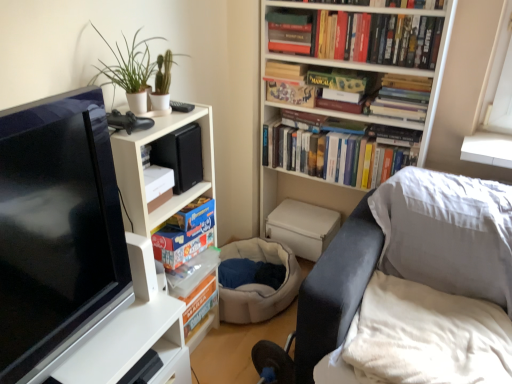
Describe the element at coordinates (289, 32) in the screenshot. I see `hardcover book at upper center, which appears as the 1th book when viewed from the top` at that location.

In order to click on dark gray leather swivel chair at lower right in this screenshot , I will do `click(327, 299)`.

What do you see at coordinates (370, 71) in the screenshot? The image size is (512, 384). I see `white matte bookcase at upper center, which is counted as the second bookcase, starting from the left` at bounding box center [370, 71].

The width and height of the screenshot is (512, 384). I want to click on hardcover book at upper center, which appears as the 1th book when viewed from the top, so click(x=289, y=32).

Considering the relative sizes of green matte plant at upper left and matte board game at center, the sixth book viewed from the top, in the image provided, is green matte plant at upper left wider than matte board game at center, the sixth book viewed from the top,?

No, green matte plant at upper left is not wider than matte board game at center, the sixth book viewed from the top.

Could you measure the distance between green matte plant at upper left and matte board game at center, the sixth book viewed from the top?

green matte plant at upper left is 18.17 inches away from matte board game at center, the sixth book viewed from the top.

From a real-world perspective, is green matte plant at upper left located higher than matte board game at center, the sixth book viewed from the top?

Yes, from a real-world perspective, green matte plant at upper left is over matte board game at center, the sixth book viewed from the top

This screenshot has height=384, width=512. I want to click on the 2nd book below the green matte plant at upper left (from the image's perspective), so click(185, 234).

Considering the relative sizes of white matte bookcase at upper center, arranged as the first bookcase when viewed from the right, and white glossy table at left in the image provided, is white matte bookcase at upper center, arranged as the first bookcase when viewed from the right, wider than white glossy table at left?

In fact, white matte bookcase at upper center, arranged as the first bookcase when viewed from the right, might be narrower than white glossy table at left.

How different are the orientations of white matte bookcase at upper center, arranged as the first bookcase when viewed from the right, and white glossy table at left in degrees?

89.7 degrees separate the facing orientations of white matte bookcase at upper center, arranged as the first bookcase when viewed from the right, and white glossy table at left.

Measure the distance between white matte bookcase at upper center, which is counted as the second bookcase, starting from the left, and white glossy table at left.

A distance of 4.16 feet exists between white matte bookcase at upper center, which is counted as the second bookcase, starting from the left, and white glossy table at left.

Which is more to the left, white matte bookcase at upper center, which is counted as the second bookcase, starting from the left, or white glossy table at left?

Positioned to the left is white glossy table at left.

Looking at this image, which of these two, matte black tv at left or hardcover book at upper center, which is counted as the 2th book, starting from the top, is wider?

matte black tv at left is wider.

Is point (35, 362) positioned behind point (418, 46)?

No, (35, 362) is closer to viewer.

From a real-world perspective, is matte black tv at left physically above hardcover book at upper center, acting as the 5th book starting from the bottom?

No, from a real-world perspective, matte black tv at left is not on top of hardcover book at upper center, acting as the 5th book starting from the bottom.

Can you confirm if matte black tv at left is shorter than hardcover book at upper center, which is counted as the 2th book, starting from the top?

No, matte black tv at left is not shorter than hardcover book at upper center, which is counted as the 2th book, starting from the top.

Considering the sizes of white matte bookcase at upper left, which is the first bookcase from left to right, and matte black tv at left in the image, is white matte bookcase at upper left, which is the first bookcase from left to right, bigger or smaller than matte black tv at left?

In the image, white matte bookcase at upper left, which is the first bookcase from left to right, appears to be larger than matte black tv at left.

Is the surface of white matte bookcase at upper left, which ranks as the second bookcase in right-to-left order, in direct contact with matte black tv at left?

white matte bookcase at upper left, which ranks as the second bookcase in right-to-left order, and matte black tv at left are not in contact.

Is point (142, 181) positioned before point (25, 369)?

No, it is not.

From a real-world perspective, is white matte bookcase at upper left, which ranks as the second bookcase in right-to-left order, positioned under matte black tv at left based on gravity?

Yes, from a real-world perspective, white matte bookcase at upper left, which ranks as the second bookcase in right-to-left order, is under matte black tv at left.

From a real-world perspective, between white soft blanket at lower right and white matte bookcase at upper center, which is counted as the second bookcase, starting from the left, who is vertically higher?

white matte bookcase at upper center, which is counted as the second bookcase, starting from the left, is physically above.

How different are the orientations of white soft blanket at lower right and white matte bookcase at upper center, arranged as the first bookcase when viewed from the right, in degrees?

They differ by 0.314 degrees in their facing directions.

Is white soft blanket at lower right touching white matte bookcase at upper center, arranged as the first bookcase when viewed from the right?

No, white soft blanket at lower right is not with white matte bookcase at upper center, arranged as the first bookcase when viewed from the right.

Consider the image. Is white matte bookcase at upper center, which is counted as the second bookcase, starting from the left, surrounded by white soft blanket at lower right?

Actually, white matte bookcase at upper center, which is counted as the second bookcase, starting from the left, is outside white soft blanket at lower right.

Based on the photo, can you confirm if dark gray leather swivel chair at lower right is wider than hardcover books at upper center, the third book in the bottom-to-top sequence?

Indeed, dark gray leather swivel chair at lower right has a greater width compared to hardcover books at upper center, the third book in the bottom-to-top sequence.

From a real-world perspective, is dark gray leather swivel chair at lower right beneath hardcover books at upper center, which is counted as the 4th book, starting from the top?

Yes, from a real-world perspective, dark gray leather swivel chair at lower right is under hardcover books at upper center, which is counted as the 4th book, starting from the top.

Is dark gray leather swivel chair at lower right positioned with its back to hardcover books at upper center, which is counted as the 4th book, starting from the top?

No, dark gray leather swivel chair at lower right is not facing away from hardcover books at upper center, which is counted as the 4th book, starting from the top.

Is point (291, 41) closer or farther from the camera than point (50, 335)?

Point (291, 41).

Can we say hardcover book at upper center, which is counted as the 2th book, starting from the top, lies outside matte black tv at left?

hardcover book at upper center, which is counted as the 2th book, starting from the top, lies outside matte black tv at left's area.

This screenshot has height=384, width=512. In order to click on television directly beneath the hardcover book at upper center, which is counted as the 2th book, starting from the top (from a real-world perspective) in this screenshot , I will do `click(57, 231)`.

Considering the relative sizes of hardcover book at upper center, which is counted as the 2th book, starting from the top, and matte black tv at left in the image provided, is hardcover book at upper center, which is counted as the 2th book, starting from the top, smaller than matte black tv at left?

Yes.

From the image's perspective, count 2nd books downward from the green matte plant at upper left and point to it. Please provide its 2D coordinates.

[(185, 234)]

From the image's perspective, which bookcase is the 2nd one above the white glossy table at left? Please provide its 2D coordinates.

[(370, 71)]

Based on their spatial positions, is hardcover books at upper center, which is counted as the 4th book, starting from the top, or hardcover book at upper center, acting as the 5th book starting from the bottom, closer to dark gray leather swivel chair at lower right?

The object closer to dark gray leather swivel chair at lower right is hardcover books at upper center, which is counted as the 4th book, starting from the top.

Considering their positions, is dark gray leather swivel chair at lower right positioned further to hardcover books at upper center, marked as the 2th book in a bottom-to-top arrangement, than white matte bookcase at upper left, which ranks as the second bookcase in right-to-left order?

white matte bookcase at upper left, which ranks as the second bookcase in right-to-left order, is positioned further to the anchor hardcover books at upper center, marked as the 2th book in a bottom-to-top arrangement.

Which object lies nearer to the anchor point white matte bookcase at upper center, arranged as the first bookcase when viewed from the right, matt black board game at upper center, which is the third book in top-to-bottom order, or hardcover books at upper center, marked as the 2th book in a bottom-to-top arrangement?

matt black board game at upper center, which is the third book in top-to-bottom order.

When comparing their distances from dark gray leather swivel chair at lower right, does white soft blanket at lower right or hardcover books at upper center, the 5th book from the top, seem closer?

Based on the image, white soft blanket at lower right appears to be nearer to dark gray leather swivel chair at lower right.

Which object lies further to the anchor point hardcover books at upper center, the 5th book from the top, dark gray leather swivel chair at lower right or white glossy table at left?

white glossy table at left is further to hardcover books at upper center, the 5th book from the top.

From the picture: Estimate the real-world distances between objects in this image. Which object is further from hardcover book at upper center, acting as the 6th book starting from the bottom, hardcover book at upper center, which is counted as the 2th book, starting from the top, or matt black board game at upper center, the 4th book from the bottom?

The object further to hardcover book at upper center, acting as the 6th book starting from the bottom, is hardcover book at upper center, which is counted as the 2th book, starting from the top.

From the image, which object appears to be farther from hardcover books at upper center, the third book in the bottom-to-top sequence, matt black board game at upper center, the 4th book from the bottom, or hardcover book at upper center, which is counted as the 2th book, starting from the top?

Based on the image, matt black board game at upper center, the 4th book from the bottom, appears to be further to hardcover books at upper center, the third book in the bottom-to-top sequence.

Considering their positions, is dark gray leather swivel chair at lower right positioned further to hardcover books at upper center, which is counted as the 4th book, starting from the top, than matte black tv at left?

The object further to hardcover books at upper center, which is counted as the 4th book, starting from the top, is matte black tv at left.

Find the location of `bookcase between matte board game at center, the first book when ordered from bottom to top, and hardcover books at upper center, which is counted as the 4th book, starting from the top, in the horizontal direction`. bookcase between matte board game at center, the first book when ordered from bottom to top, and hardcover books at upper center, which is counted as the 4th book, starting from the top, in the horizontal direction is located at coordinates (370, 71).

Identify the location of swivel chair located between white glossy table at left and hardcover books at upper center, marked as the 2th book in a bottom-to-top arrangement, in the left-right direction. (327, 299).

This screenshot has height=384, width=512. In order to click on swivel chair between hardcover book at upper center, which appears as the 1th book when viewed from the top, and white glossy table at left, in the vertical direction in this screenshot , I will do `click(327, 299)`.

Locate an element on the screen. The height and width of the screenshot is (384, 512). houseplant between hardcover book at upper center, acting as the 6th book starting from the bottom, and dark gray leather swivel chair at lower right in the up-down direction is located at coordinates (139, 75).